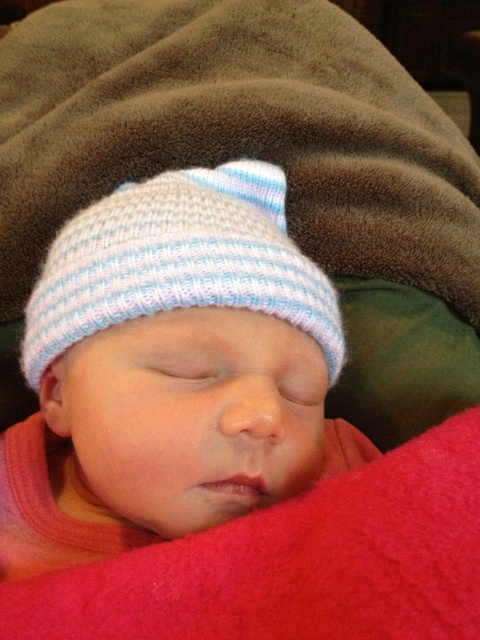
You are a photographer taking a close up of a baby. You need to ensure that the white knitted hat at center and the light blue knitted hat at upper center are both visible in the frame. Given their sizes, which hat should you adjust your focus to prioritize to ensure both are fully visible?

The white knitted hat at center is wider than the light blue knitted hat at upper center. To ensure both are fully visible, prioritize focusing on the white knitted hat at center since it requires more space due to its larger width.

You are a photographer adjusting your camera to focus on two points in the image of the sleeping baby. The first point is at coordinates point (x=96, y=490) and the second is at point (x=140, y=216). Which point should you focus on first if you want to ensure the closest object is in focus?

Point (x=96, y=490) is closer to the camera than point (x=140, y=216), so you should focus on point (x=96, y=490) first to ensure the closest object is in focus.

You are a photographer adjusting the focus on your camera. You need to focus on the closest point between point A at point (47,509) and point B at point (26,586). Which point should you focus on?

Point B at point (26,586) is closer to the camera than point A at point (47,509), so you should focus on point B at point (26,586).